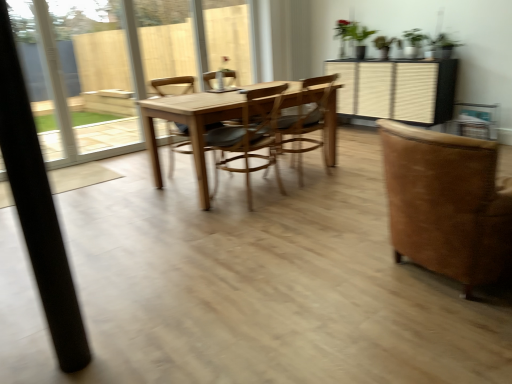
Find the location of a particular element. empty space that is in between wooden at center, which is the 3th chair in right-to-left order, and black matte pole at left is located at coordinates (188, 252).